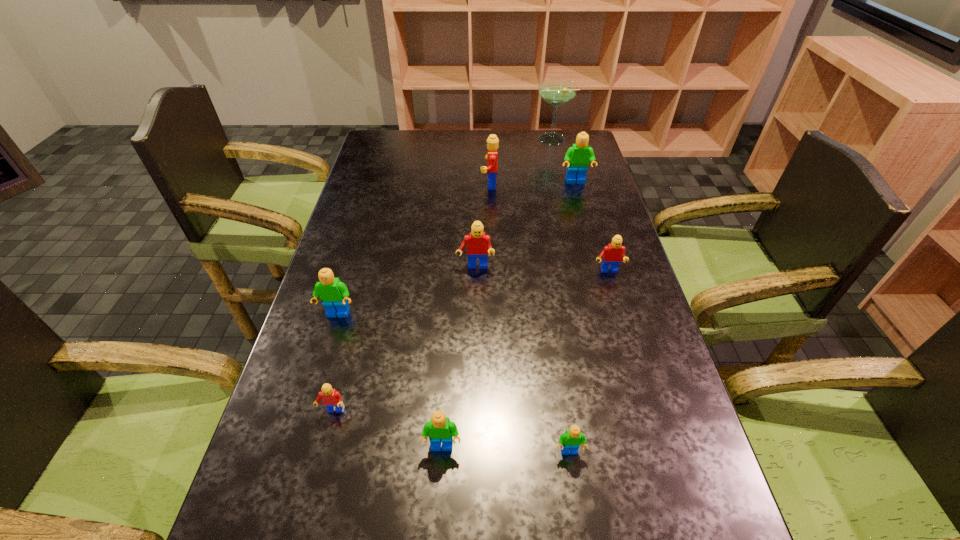
Image resolution: width=960 pixels, height=540 pixels. Find the location of `vacant space located on the front-facing side of the second biggest red Lego`. vacant space located on the front-facing side of the second biggest red Lego is located at coordinates (474, 381).

I want to click on free space located 0.260m on the front-facing side of the rightmost red Lego, so click(633, 356).

Locate an element on the screen. Image resolution: width=960 pixels, height=540 pixels. vacant region located 0.120m on the face of the third biggest green Lego is located at coordinates (437, 524).

Image resolution: width=960 pixels, height=540 pixels. I want to click on free space located on the face of the smallest green Lego, so click(578, 509).

This screenshot has width=960, height=540. Find the location of `free space located 0.130m on the front-facing side of the smallest red Lego`. free space located 0.130m on the front-facing side of the smallest red Lego is located at coordinates (315, 483).

Locate an element on the screen. object present at the far edge is located at coordinates (556, 92).

This screenshot has width=960, height=540. I want to click on martini at the right edge, so click(x=556, y=92).

Where is `object situated at the far right corner`? Image resolution: width=960 pixels, height=540 pixels. object situated at the far right corner is located at coordinates (556, 92).

Locate an element on the screen. The image size is (960, 540). vacant space at the far edge is located at coordinates (542, 149).

This screenshot has height=540, width=960. In the image, there is a desktop. Find the location of `vacant space at the left edge`. vacant space at the left edge is located at coordinates (272, 454).